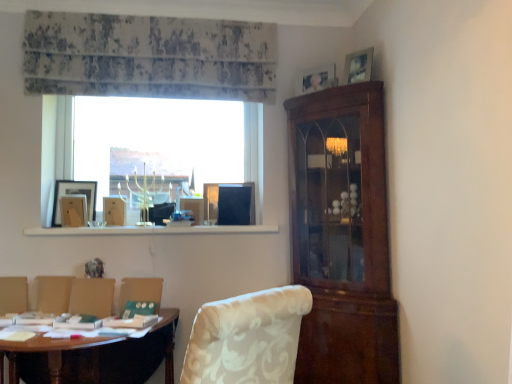
Question: Is wooden picture frame at left, the first picture frame from the left, located outside wooden picture frame at upper right, which ranks as the 4th picture frame in bottom-to-top order?

Choices:
 (A) yes
 (B) no

Answer: (A)

Question: Considering the relative sizes of wooden picture frame at left, the first picture frame from the left, and wooden picture frame at upper right, which ranks as the 4th picture frame in bottom-to-top order, in the image provided, is wooden picture frame at left, the first picture frame from the left, wider than wooden picture frame at upper right, which ranks as the 4th picture frame in bottom-to-top order,?

Choices:
 (A) yes
 (B) no

Answer: (B)

Question: From a real-world perspective, is wooden picture frame at left, which appears as the 3th picture frame when viewed from the top, below wooden picture frame at upper right, acting as the first picture frame starting from the right?

Choices:
 (A) yes
 (B) no

Answer: (A)

Question: Is wooden picture frame at left, which appears as the 3th picture frame when viewed from the top, thinner than wooden picture frame at upper right, which ranks as the 4th picture frame in bottom-to-top order?

Choices:
 (A) yes
 (B) no

Answer: (A)

Question: Can you confirm if wooden picture frame at left, which appears as the 3th picture frame when viewed from the top, is smaller than wooden picture frame at upper right, which is counted as the 1th picture frame, starting from the top?

Choices:
 (A) yes
 (B) no

Answer: (B)

Question: From their relative heights in the image, would you say wooden picture frame at upper left, placed as the fourth picture frame when sorted from top to bottom, is taller or shorter than white floral fabric armchair at lower center, positioned as the 4th armchair in left-to-right order?

Choices:
 (A) tall
 (B) short

Answer: (B)

Question: Looking at the image, does wooden picture frame at upper left, placed as the fourth picture frame when sorted from top to bottom, seem bigger or smaller compared to white floral fabric armchair at lower center, positioned as the 4th armchair in left-to-right order?

Choices:
 (A) big
 (B) small

Answer: (B)

Question: Considering their positions, is wooden picture frame at upper left, placed as the fourth picture frame when sorted from top to bottom, located in front of or behind white floral fabric armchair at lower center, positioned as the 4th armchair in left-to-right order?

Choices:
 (A) front
 (B) behind

Answer: (B)

Question: From the image's perspective, relative to white floral fabric armchair at lower center, arranged as the first armchair when viewed from the right, is wooden picture frame at upper left, which ranks as the 3th picture frame in right-to-left order, above or below?

Choices:
 (A) above
 (B) below

Answer: (A)

Question: From the image's perspective, relative to white floral fabric armchair at lower left, placed as the 2th armchair when sorted from left to right, is wooden picture frame at upper right, acting as the first picture frame starting from the right, above or below?

Choices:
 (A) below
 (B) above

Answer: (B)

Question: In terms of width, does wooden picture frame at upper right, which is counted as the 1th picture frame, starting from the top, look wider or thinner when compared to white floral fabric armchair at lower left, positioned as the 3th armchair in right-to-left order?

Choices:
 (A) thin
 (B) wide

Answer: (B)

Question: Relative to white floral fabric armchair at lower left, placed as the 2th armchair when sorted from left to right, is wooden picture frame at upper right, which is counted as the 1th picture frame, starting from the top, in front or behind?

Choices:
 (A) front
 (B) behind

Answer: (B)

Question: Is point (352, 74) closer or farther from the camera than point (37, 306)?

Choices:
 (A) farther
 (B) closer

Answer: (A)

Question: In terms of size, does wooden picture frame at upper left, placed as the fourth picture frame when sorted from top to bottom, appear bigger or smaller than white floral fabric armchair at lower left, positioned as the first armchair in left-to-right order?

Choices:
 (A) small
 (B) big

Answer: (B)

Question: Which is correct: wooden picture frame at upper left, the first picture frame ordered from the bottom, is inside white floral fabric armchair at lower left, positioned as the first armchair in left-to-right order, or outside of it?

Choices:
 (A) inside
 (B) outside

Answer: (B)